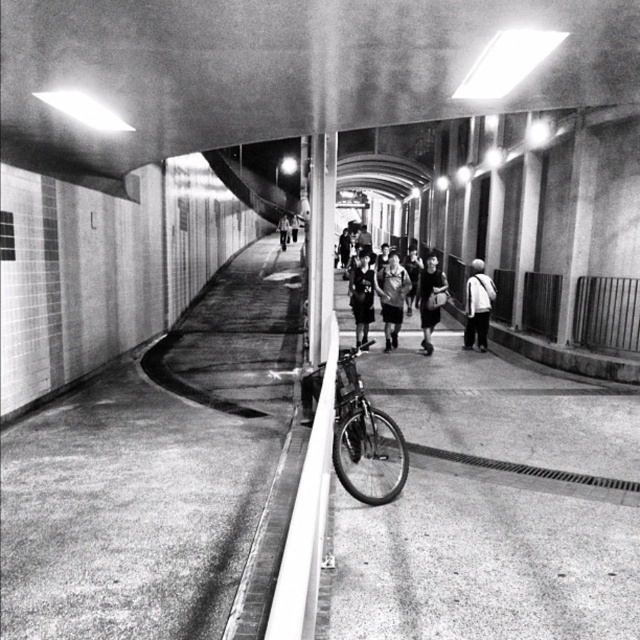
You are standing at the entrance of the corridor and see both the shiny metallic bicycle at center and the dark gray fabric bag at center. Which object is nearer to you?

The shiny metallic bicycle at center is closer to the viewer than the dark gray fabric bag at center.

You are a security guard patrolling the corridor and notice a dark gray fabric bag at center and a dark gray uniform at center. Which item is positioned lower in the corridor?

The dark gray fabric bag at center is located below the dark gray uniform at center, so it is positioned lower in the corridor.

You are a security guard in the tunnel corridor and you see a dark gray fabric bag at center and a dark gray uniform at center. Which object is bigger in size?

The dark gray fabric bag at center is larger in size compared to the dark gray uniform at center.